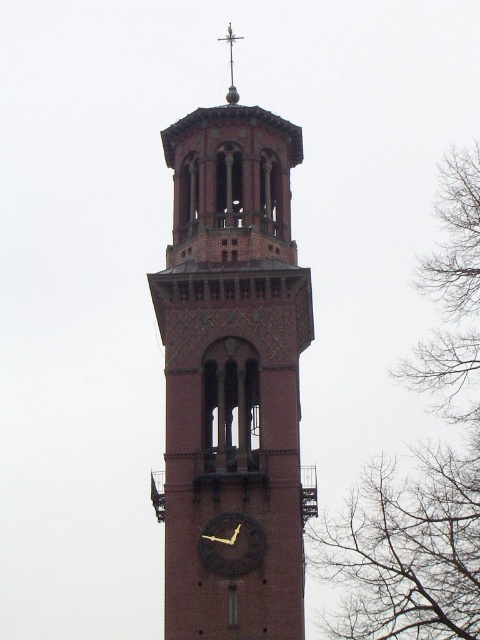
You are standing in front of the clock tower and notice two elements in the image. You see the bare branches at right and the black matte clock at center. Which of these two elements is positioned more to the east side of the clock tower?

The bare branches at right are to the right of the black matte clock at center, so they are positioned more to the east side of the clock tower.

You are standing at the coordinates 0.5, 0.5 in the image. You want to locate the brick clock tower at center. In which direction should you move to face it?

Answer: Since the brick clock tower at center is located at coordinates (232, 371), which is slightly to the right and above your current position at (240, 320), you should move slightly to the right and down to face it.

You are standing in front of the clock tower and notice a point marked at coordinates (x=421, y=467). What object does this point correspond to?

The point corresponds to the bare branches at right.